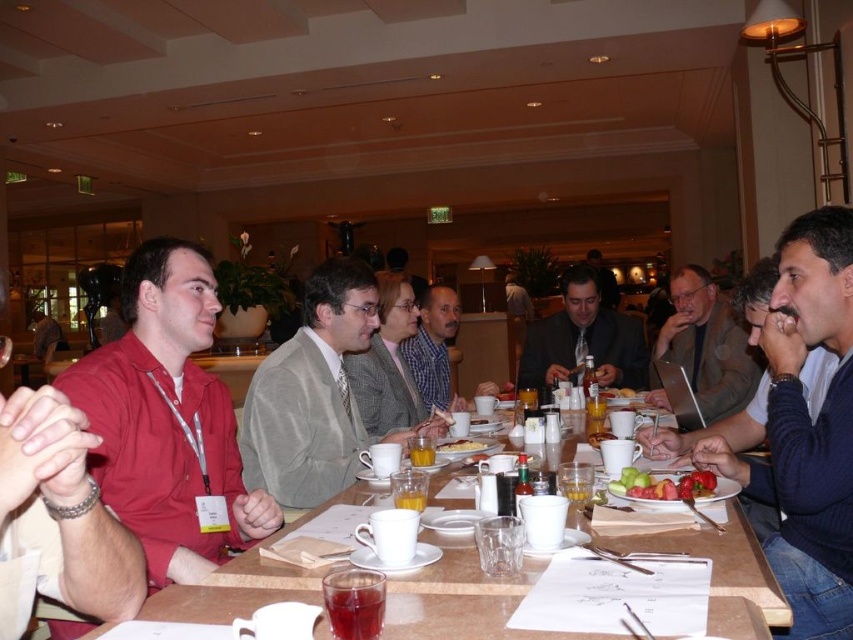
You are a security guard standing at the entrance of the conference room. You need to check the ID badge of the person wearing the gray wool suit at center. Can you reach them without moving from your current position? The maximum distance you can extend your arm is 2.5 meters.

The gray wool suit at center and viewer are 2.80 meters apart, which is beyond the security guard can reach with their arm extended to 2.5 meters. Therefore, the security guard cannot reach them without moving.

You are organizing a photoshoot and need to ensure that the two central figures in the image, wearing the gray wool suit at center and the blue plaid shirt at center, can fit side by side on a platform that is 1.2 meters wide. Based on their clothing sizes, will they fit comfortably?

The gray wool suit at center has a larger width than the blue plaid shirt at center. However, without specific measurements of their actual widths, it is impossible to determine if they will fit comfortably on a 1.2 meter platform.